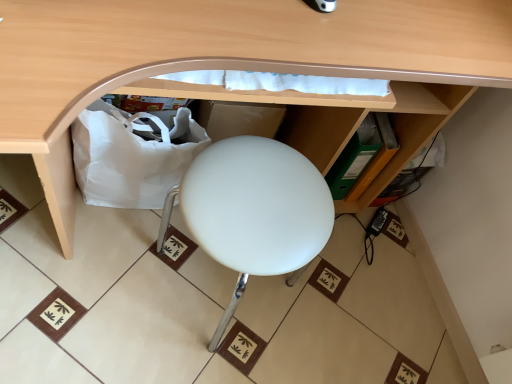
Question: From the image's perspective, is white fabric bag at lower left located above or below matte wood desk at center?

Choices:
 (A) below
 (B) above

Answer: (A)

Question: From a real-world perspective, is white fabric bag at lower left above or below matte wood desk at center?

Choices:
 (A) below
 (B) above

Answer: (A)

Question: Estimate the real-world distances between objects in this image. Which object is farther from the matte wood desk at center?

Choices:
 (A) white fabric bag at lower left
 (B) white matte stool at center

Answer: (A)

Question: Which object is the farthest from the matte wood desk at center?

Choices:
 (A) white fabric bag at lower left
 (B) white matte stool at center

Answer: (A)